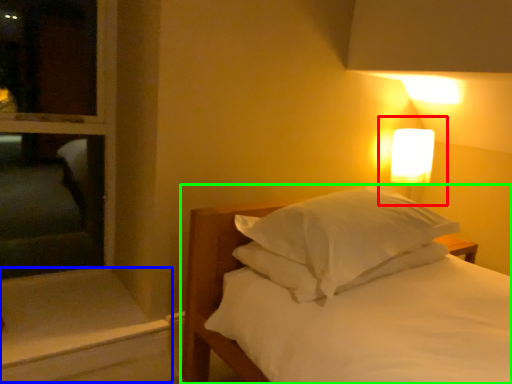
Question: Considering the real-world distances, which object is closest to bedside lamp (highlighted by a red box)? window sill (highlighted by a blue box) or bed (highlighted by a green box).

Choices:
 (A) window sill
 (B) bed

Answer: (B)